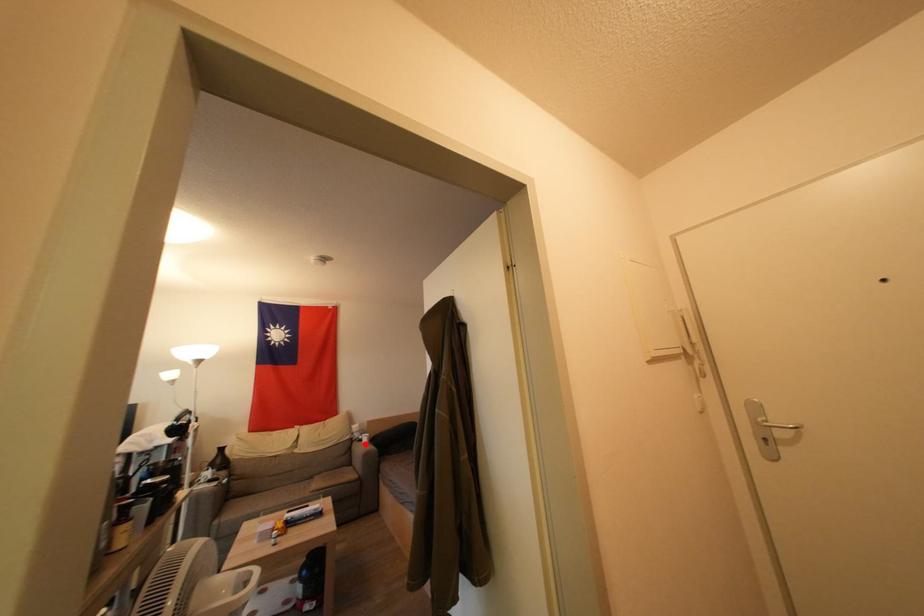
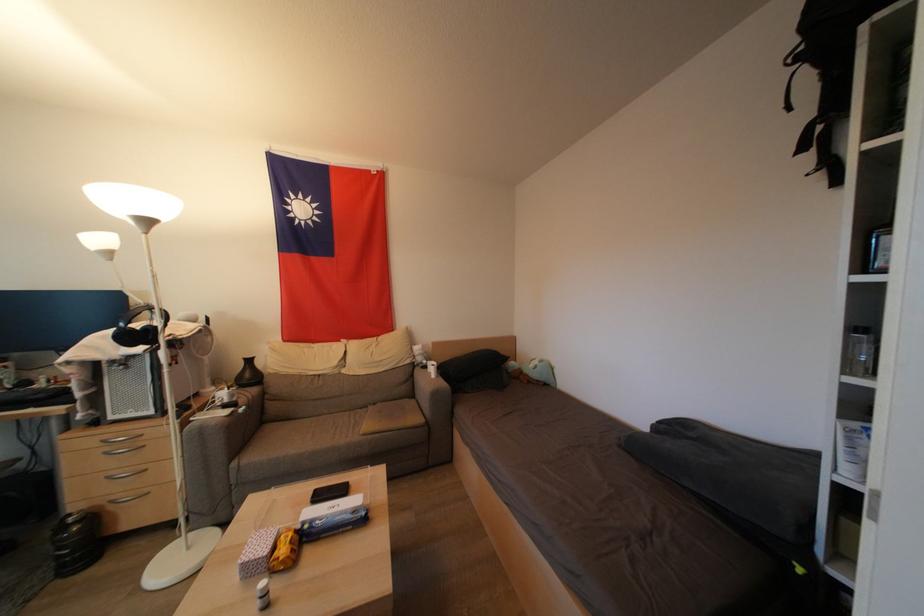
In the second image, find the point that corresponds to the highlighted location in the first image.

(430, 371)